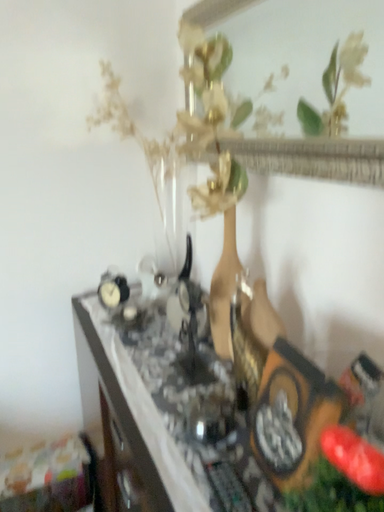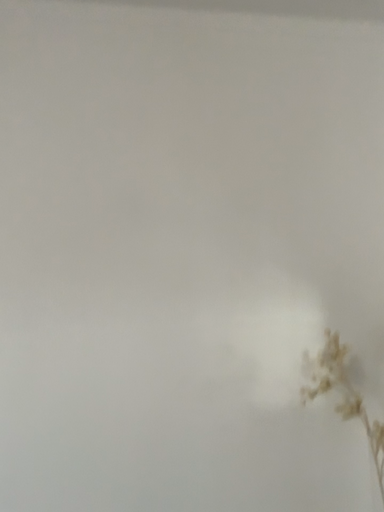
Question: How did the camera likely rotate when shooting the video?

Choices:
 (A) rotated upward
 (B) rotated downward

Answer: (A)